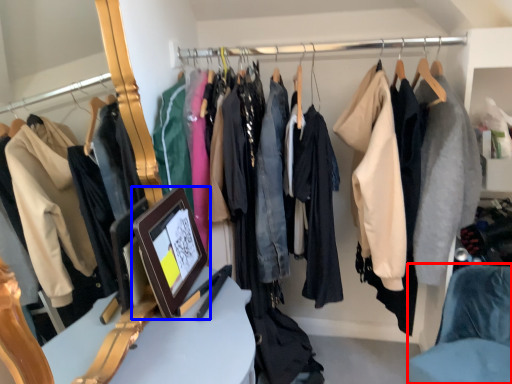
Question: Among these objects, which one is nearest to the camera, chair (highlighted by a red box) or picture frame (highlighted by a blue box)?

Choices:
 (A) chair
 (B) picture frame

Answer: (B)